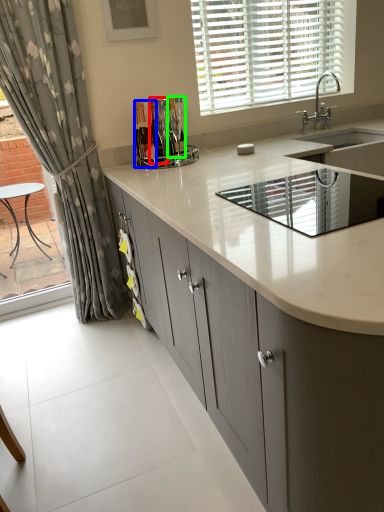
Question: Which object is the farthest from bottle (highlighted by a red box)? Choose among these: bottle (highlighted by a blue box) or bottle (highlighted by a green box).

Choices:
 (A) bottle
 (B) bottle

Answer: (B)